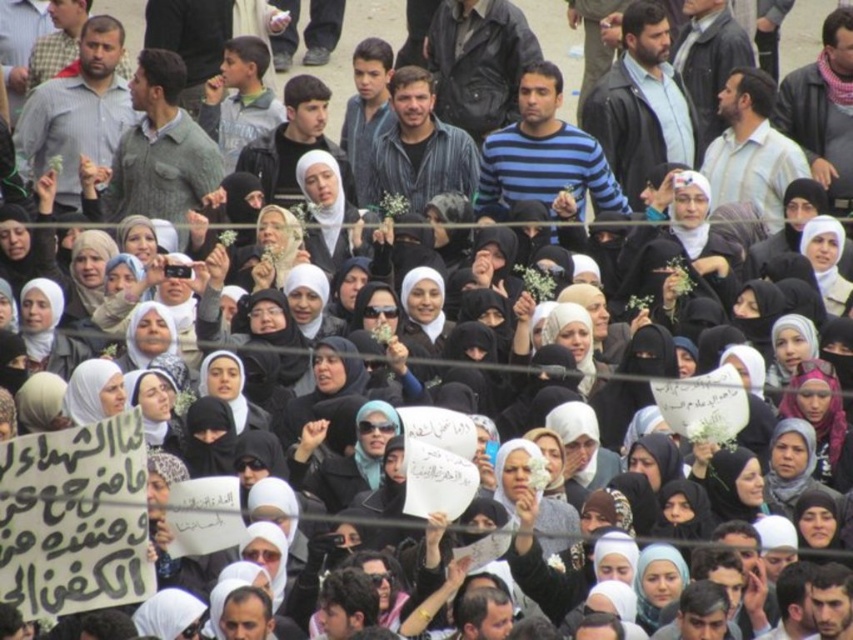
Does white fabric headscarf at lower left appear over matte black hijab at center?

Yes.

Does white fabric headscarf at lower left have a larger size compared to matte black hijab at center?

Incorrect, white fabric headscarf at lower left is not larger than matte black hijab at center.

Is point (57, 362) positioned before point (231, 394)?

No, it is behind (231, 394).

Where is `white fabric headscarf at lower left`? The height and width of the screenshot is (640, 853). white fabric headscarf at lower left is located at coordinates (47, 330).

The height and width of the screenshot is (640, 853). In order to click on white fabric headscarf at lower left in this screenshot , I will do `click(47, 330)`.

Which is below, white fabric headscarf at lower left or white fabric headscarf at center?

Positioned lower is white fabric headscarf at lower left.

Find the location of a particular element. white fabric headscarf at lower left is located at coordinates (47, 330).

Does white fabric headscarf at center lie behind matte black hijab at center?

Yes.

How distant is white fabric headscarf at center from matte black hijab at center?

A distance of 11.15 meters exists between white fabric headscarf at center and matte black hijab at center.

This screenshot has height=640, width=853. I want to click on white fabric headscarf at center, so click(273, 248).